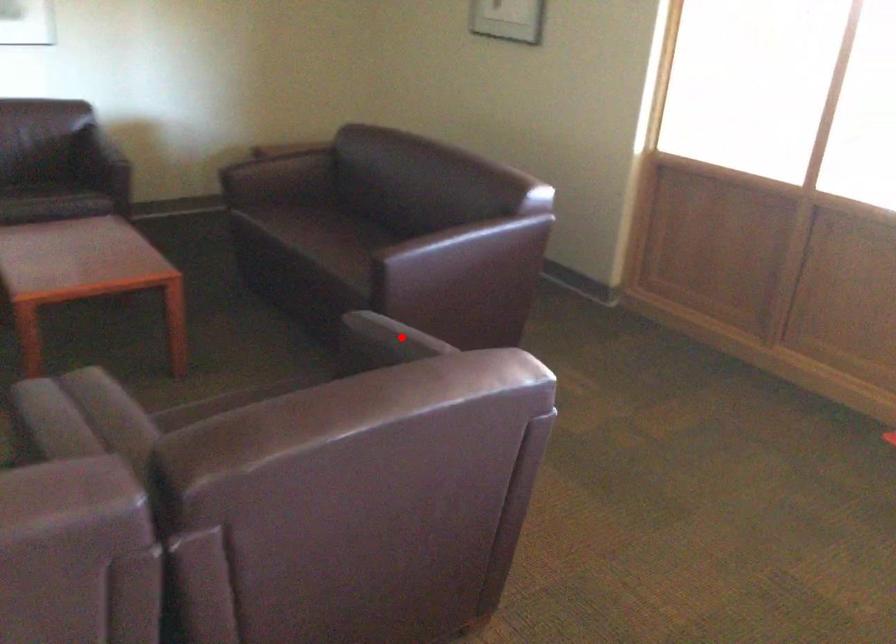
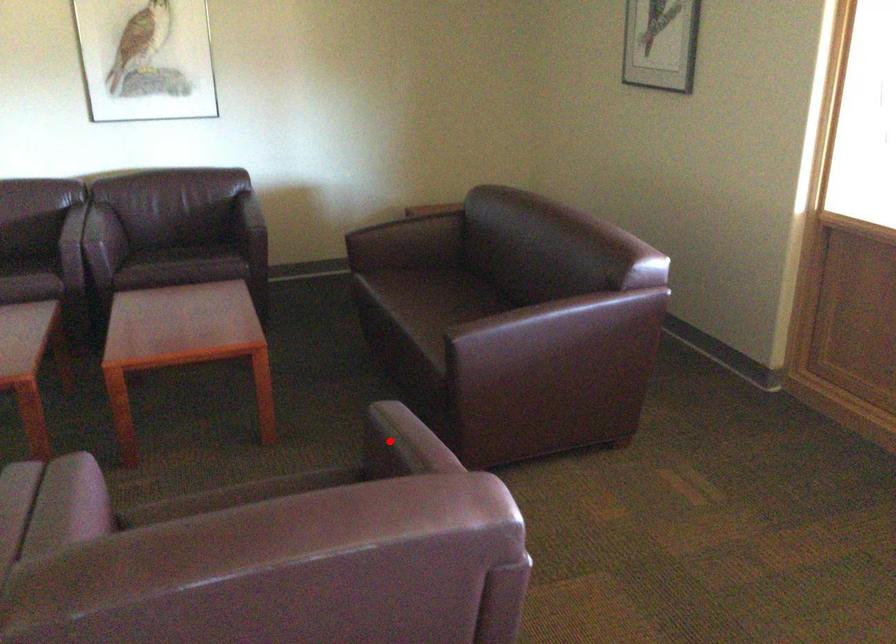
I am providing you with two images of the same scene from different viewpoints. A red point is marked on the first image and another point is marked on the second image. Do the highlighted points in image1 and image2 indicate the same real-world spot?

Yes